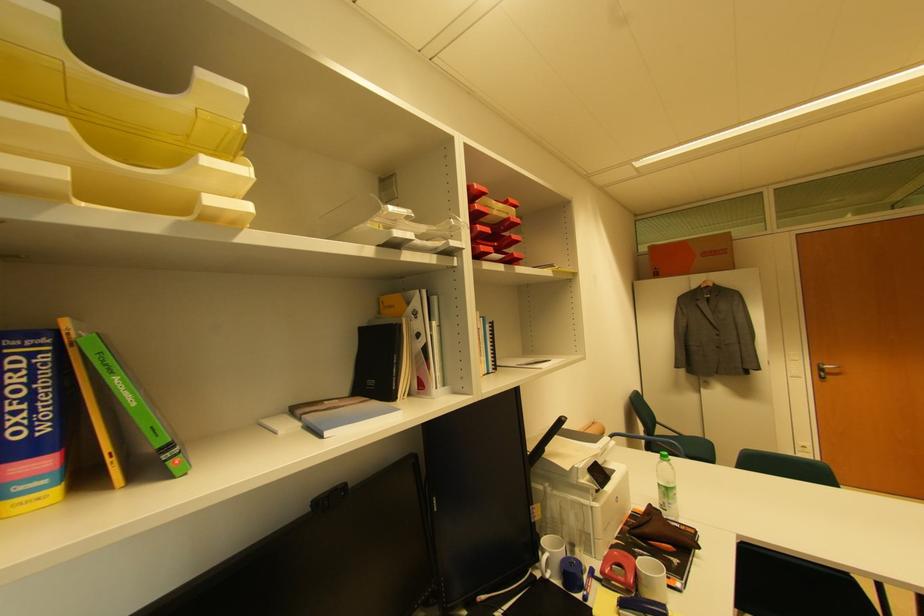
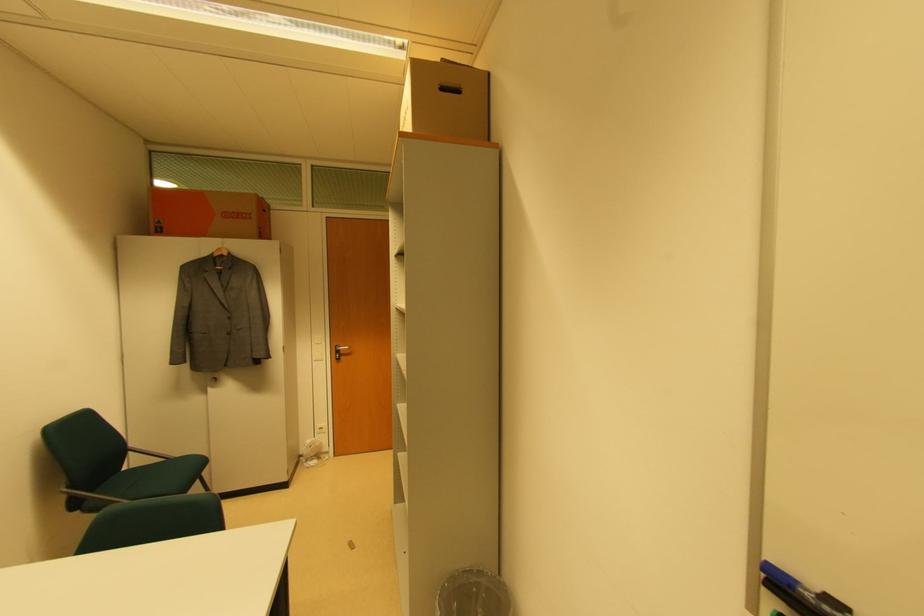
Where in the second image is the point corresponding to point 659,275 from the first image?

(163, 230)